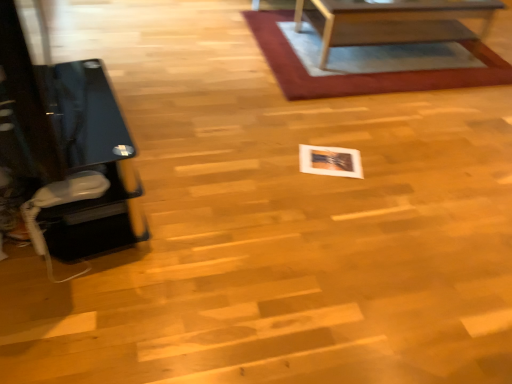
Question: Considering the relative sizes of black glass table at left and rug with woven texture at upper center in the image provided, is black glass table at left thinner than rug with woven texture at upper center?

Choices:
 (A) yes
 (B) no

Answer: (A)

Question: Could you tell me if black glass table at left is facing rug with woven texture at upper center?

Choices:
 (A) yes
 (B) no

Answer: (A)

Question: Considering the relative sizes of black glass table at left and rug with woven texture at upper center in the image provided, is black glass table at left taller than rug with woven texture at upper center?

Choices:
 (A) yes
 (B) no

Answer: (A)

Question: From a real-world perspective, is black glass table at left located beneath rug with woven texture at upper center?

Choices:
 (A) yes
 (B) no

Answer: (B)

Question: Does black glass table at left appear on the right side of rug with woven texture at upper center?

Choices:
 (A) yes
 (B) no

Answer: (B)

Question: Is black glass table at left to the left of rug with woven texture at upper center from the viewer's perspective?

Choices:
 (A) yes
 (B) no

Answer: (A)

Question: Can you confirm if black glass table at left is positioned to the right of white glossy photo frame at center?

Choices:
 (A) no
 (B) yes

Answer: (A)

Question: Considering the relative sizes of black glass table at left and white glossy photo frame at center in the image provided, is black glass table at left taller than white glossy photo frame at center?

Choices:
 (A) yes
 (B) no

Answer: (A)

Question: Is black glass table at left to the left of white glossy photo frame at center from the viewer's perspective?

Choices:
 (A) yes
 (B) no

Answer: (A)

Question: Is black glass table at left positioned before white glossy photo frame at center?

Choices:
 (A) no
 (B) yes

Answer: (B)

Question: Is black glass table at left further to the viewer compared to white glossy photo frame at center?

Choices:
 (A) no
 (B) yes

Answer: (A)

Question: Can you confirm if black glass table at left is wider than white glossy photo frame at center?

Choices:
 (A) no
 (B) yes

Answer: (B)

Question: From the image's perspective, is wooden table at upper center located above white glossy photo frame at center?

Choices:
 (A) no
 (B) yes

Answer: (B)